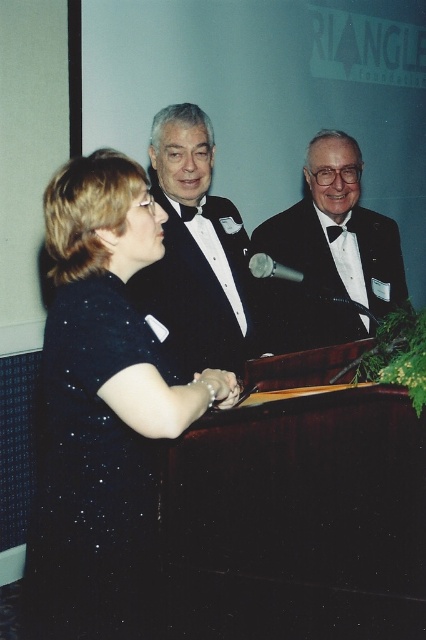
You are at a formal event and need to locate the black satin tuxedo at center. According to the coordinate system where the bottom left corner is the origin, can you confirm if the point at (196,252) is the correct location for it?

Yes, the black satin tuxedo at center is represented by point (196,252), so the coordinates are correct.

You are a photographer trying to capture a closeup of the two points in the image. Which point, point [230,364] or point [189,218], is closer to your camera lens?

Point [230,364] is closer to the camera lens than point [189,218].